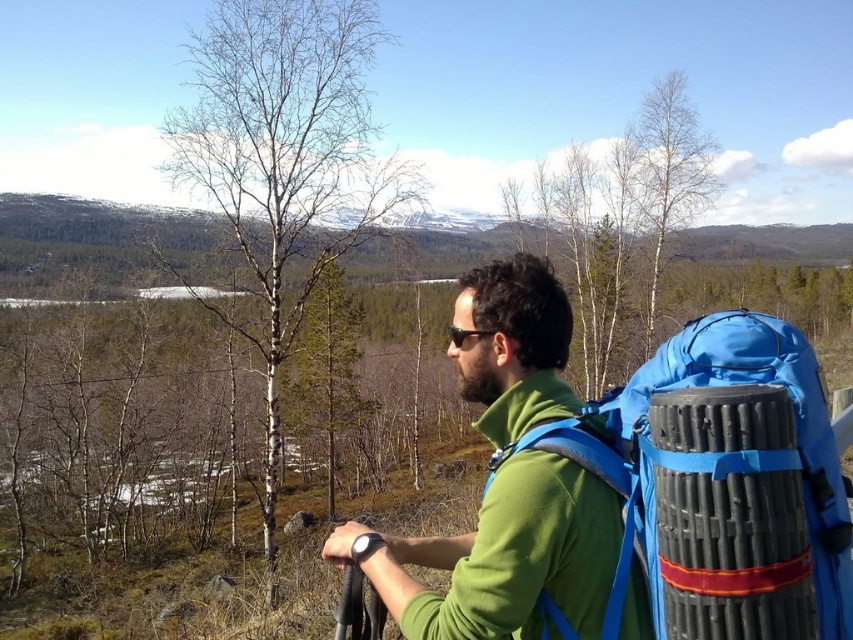
Question: From the image, what is the correct spatial relationship of blue fabric backpack at center-right in relation to black plastic sunglasses at center?

Choices:
 (A) below
 (B) above

Answer: (A)

Question: Among these objects, which one is nearest to the camera?

Choices:
 (A) blue fabric backpack at center-right
 (B) black plastic sunglasses at center
 (C) green matte jacket at center

Answer: (A)

Question: Is blue fabric backpack at center-right bigger than black plastic sunglasses at center?

Choices:
 (A) yes
 (B) no

Answer: (A)

Question: Which of the following is the closest to the observer?

Choices:
 (A) (509, 332)
 (B) (457, 337)
 (C) (822, 576)

Answer: (C)

Question: Which is nearer to the green matte jacket at center?

Choices:
 (A) black plastic sunglasses at center
 (B) blue fabric backpack at center-right

Answer: (B)

Question: Is the position of green matte jacket at center less distant than that of blue fabric backpack at center-right?

Choices:
 (A) yes
 (B) no

Answer: (B)